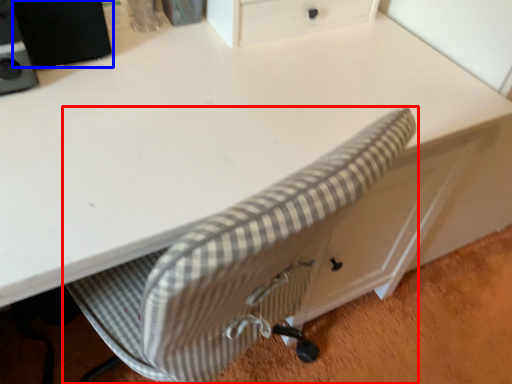
Question: Which object appears closest to the camera in this image, chair (highlighted by a red box) or speaker (highlighted by a blue box)?

Choices:
 (A) chair
 (B) speaker

Answer: (B)